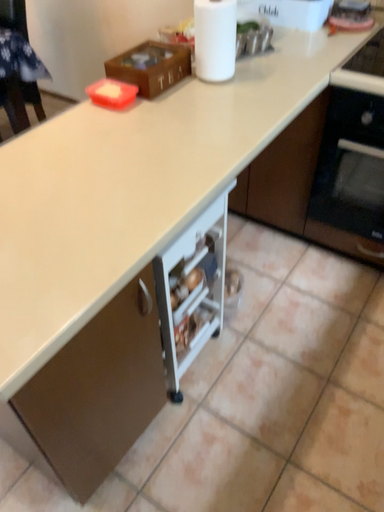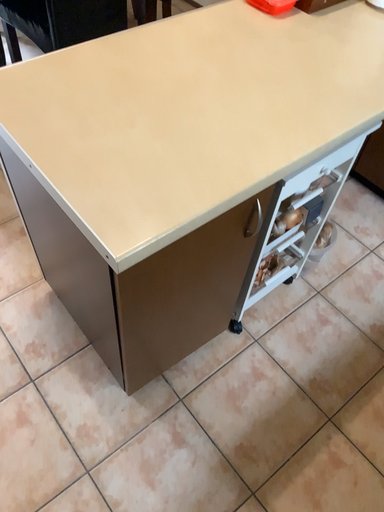
Question: Which way did the camera rotate in the video?

Choices:
 (A) rotated left
 (B) rotated right

Answer: (A)